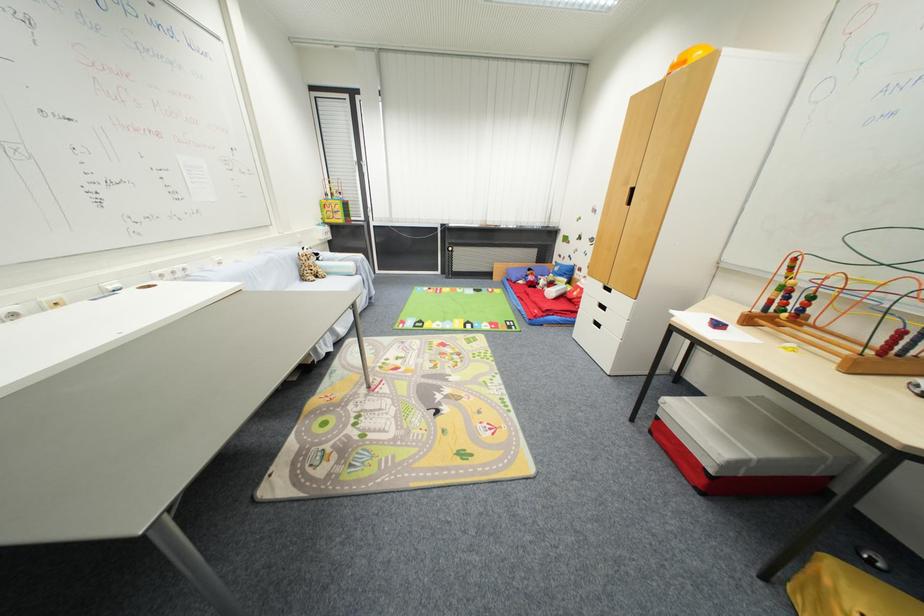
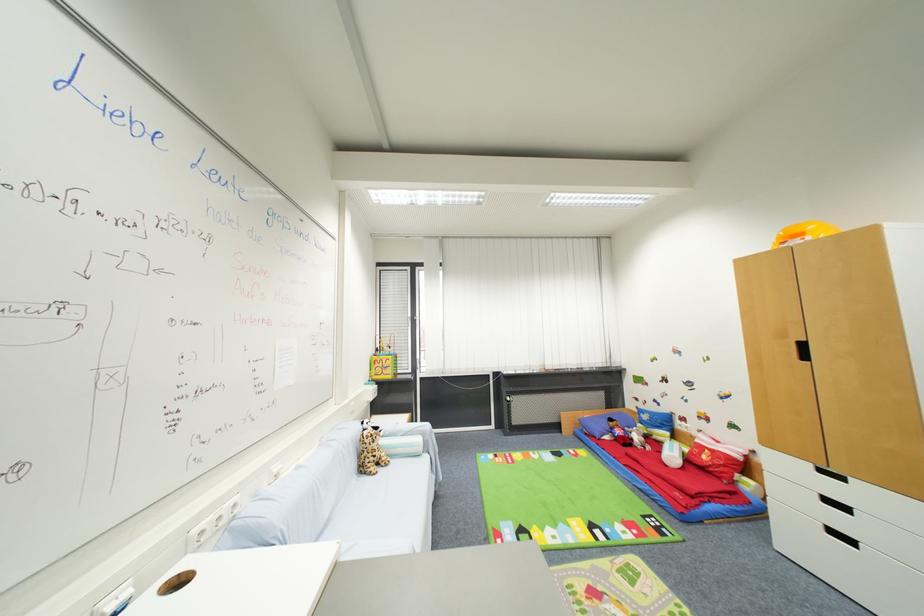
Locate, in the second image, the point that corresponds to the point at 323,282 in the first image.

(385, 472)